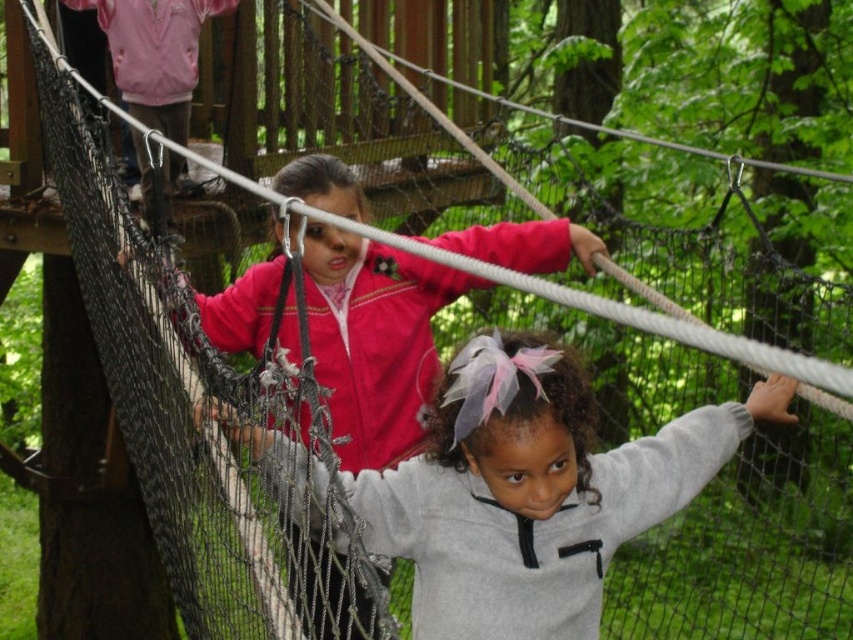
Looking at this image, does gray fleece jacket at center appear on the right side of pink fleece jacket at upper center?

Indeed, gray fleece jacket at center is positioned on the right side of pink fleece jacket at upper center.

Between point (506, 349) and point (422, 259), which one is positioned behind?

Positioned behind is point (422, 259).

Identify the location of gray fleece jacket at center. This screenshot has height=640, width=853. (532, 490).